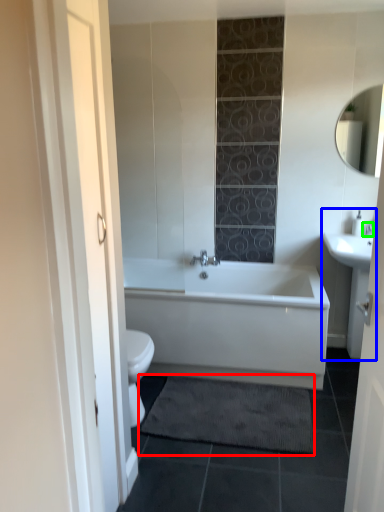
Question: Which object is positioned farthest from bath mat (highlighted by a red box)? Select from sink (highlighted by a blue box) and faucet (highlighted by a green box).

Choices:
 (A) sink
 (B) faucet

Answer: (B)